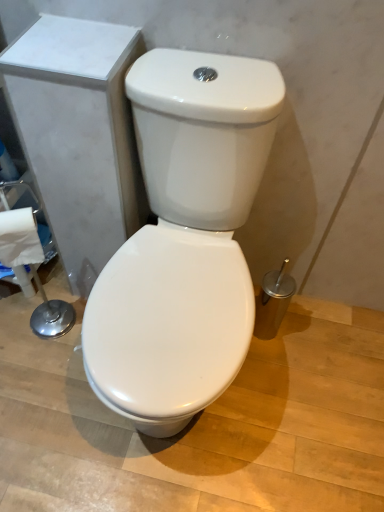
Question: Is white glossy toilet at center bigger or smaller than white paper towel at lower left?

Choices:
 (A) big
 (B) small

Answer: (A)

Question: In the image, is white glossy toilet at center positioned in front of or behind white paper towel at lower left?

Choices:
 (A) front
 (B) behind

Answer: (A)

Question: Is white glossy toilet at center inside the boundaries of white paper towel at lower left, or outside?

Choices:
 (A) inside
 (B) outside

Answer: (B)

Question: From their relative heights in the image, would you say white paper towel at lower left is taller or shorter than white glossy toilet at center?

Choices:
 (A) short
 (B) tall

Answer: (A)

Question: Looking at their shapes, would you say white paper towel at lower left is wider or thinner than white glossy toilet at center?

Choices:
 (A) thin
 (B) wide

Answer: (A)

Question: From a real-world perspective, is white paper towel at lower left positioned above or below white glossy toilet at center?

Choices:
 (A) below
 (B) above

Answer: (B)

Question: Is white paper towel at lower left situated inside white glossy toilet at center or outside?

Choices:
 (A) inside
 (B) outside

Answer: (B)